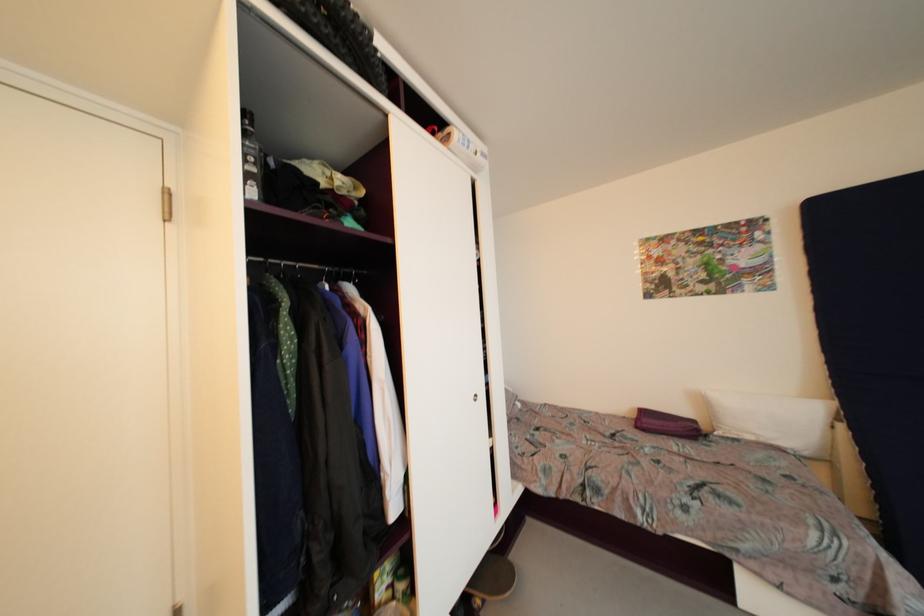
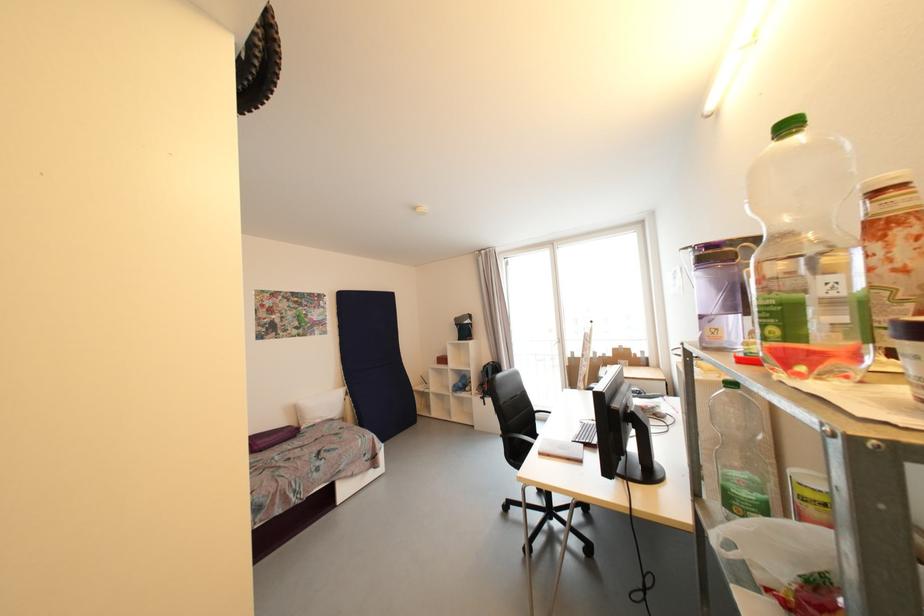
Where in the second image is the point corresponding to pixel 650 422 from the first image?

(263, 445)